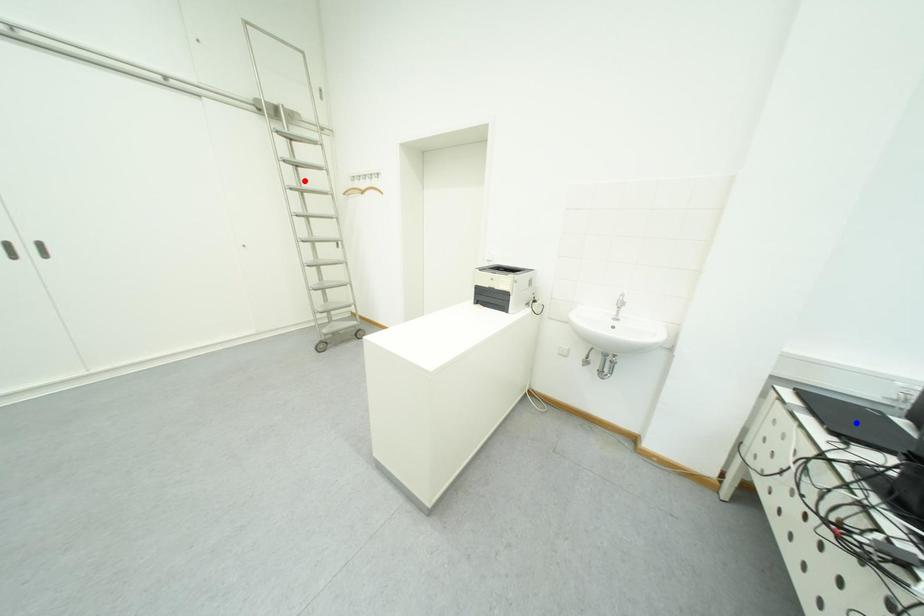
Question: In the image, two points are highlighted. Which point is nearer to the camera? Reply with the corresponding letter.

Choices:
 (A) blue point
 (B) red point

Answer: (A)